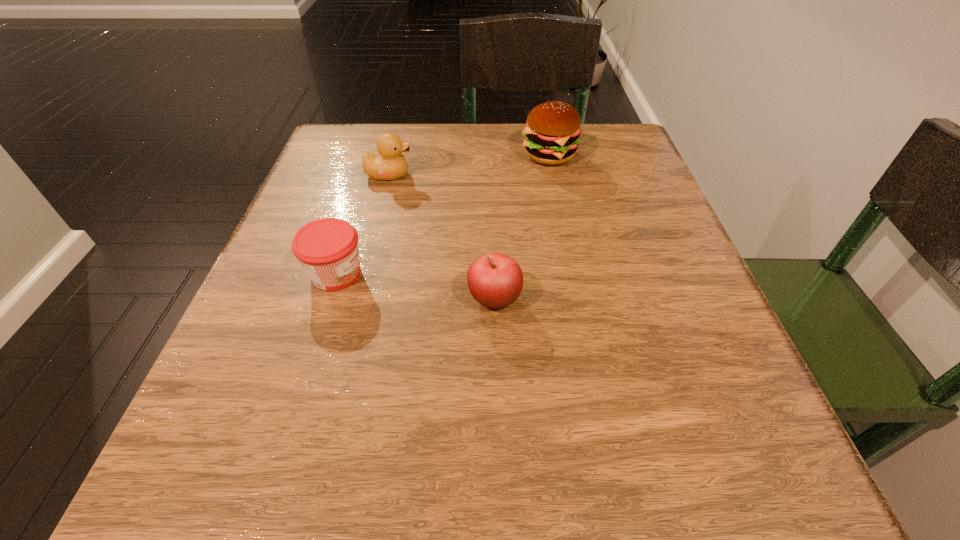
At what (x,y) coordinates should I click in order to perform the action: click on the rightmost object. Please return your answer as a coordinate pair (x, y). The height and width of the screenshot is (540, 960). Looking at the image, I should click on (552, 130).

Where is `hamburger`? hamburger is located at coordinates (552, 130).

Image resolution: width=960 pixels, height=540 pixels. I want to click on duckling, so click(390, 164).

Where is `apple`? This screenshot has width=960, height=540. apple is located at coordinates (495, 280).

Find the location of a particular element. The width and height of the screenshot is (960, 540). jam is located at coordinates (327, 249).

Where is `vacant space located 0.140m on the front of the hamburger`? This screenshot has width=960, height=540. vacant space located 0.140m on the front of the hamburger is located at coordinates (562, 214).

At what (x,y) coordinates should I click in order to perform the action: click on vacant space located 0.120m facing forward on the duckling. Please return your answer as a coordinate pair (x, y). This screenshot has height=540, width=960. Looking at the image, I should click on (473, 174).

Where is `free spot located 0.260m on the left of the third object from left to right`? free spot located 0.260m on the left of the third object from left to right is located at coordinates (292, 299).

Where is `free location located 0.360m on the label side of the jam`? Image resolution: width=960 pixels, height=540 pixels. free location located 0.360m on the label side of the jam is located at coordinates (596, 274).

Find the location of a particular element. hamburger that is at the far edge is located at coordinates (552, 130).